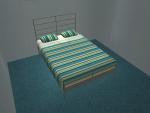
In order to click on right back corner in this screenshot , I will do `click(95, 38)`.